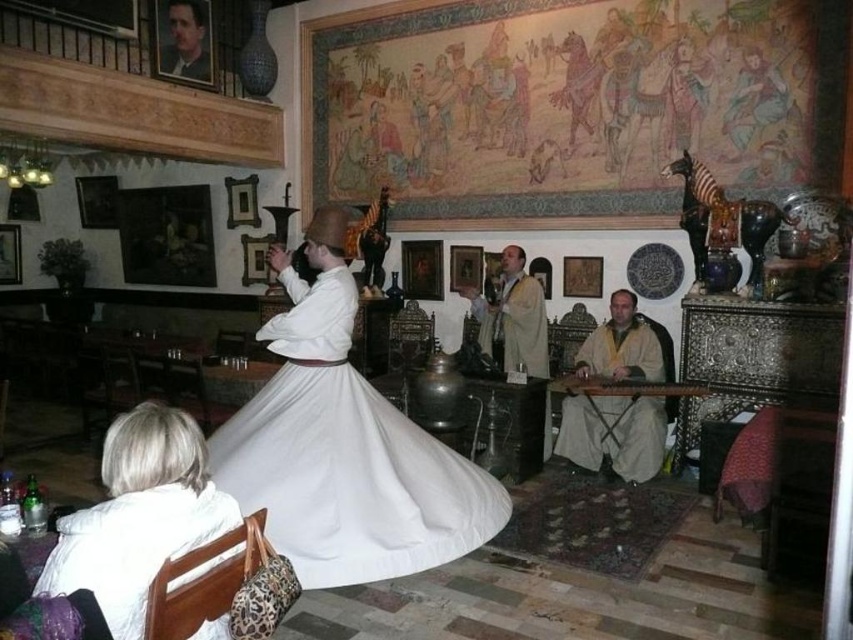
Question: Which point is farther to the camera?

Choices:
 (A) (428, 472)
 (B) (511, 289)
 (C) (631, 465)
 (D) (137, 580)

Answer: (B)

Question: Can you confirm if white cotton dress at center is positioned to the left of white clothed figure at center?

Choices:
 (A) yes
 (B) no

Answer: (A)

Question: Based on their relative distances, which object is nearer to the white clothed figure at center?

Choices:
 (A) white fabric at lower left
 (B) white cotton dress at center

Answer: (B)

Question: Does white cotton dress at center appear under white clothed figure at center?

Choices:
 (A) yes
 (B) no

Answer: (A)

Question: Which of these objects is positioned farthest from the white fabric at lower left?

Choices:
 (A) white cotton dress at center
 (B) beige woolen robe at right
 (C) white clothed figure at center

Answer: (C)

Question: Where is white fabric at lower left located in relation to beige woolen robe at right in the image?

Choices:
 (A) below
 (B) above

Answer: (A)